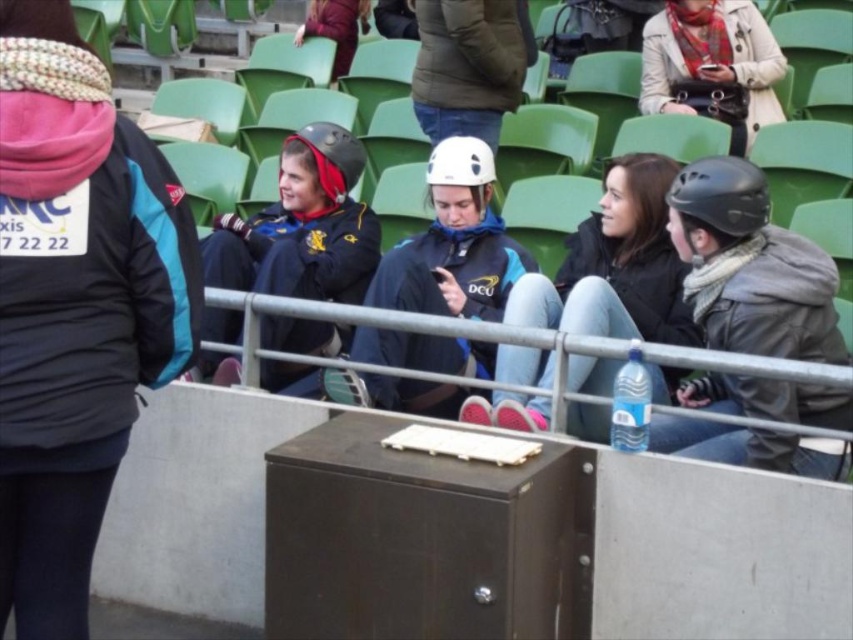
You are a spectator at a sports event and want to locate two items in the scene. The first item is the matte black helmet at left, and the second is the plaid scarf at upper right. Which item is positioned higher in the image?

The plaid scarf at upper right is positioned higher in the image than the matte black helmet at left.

You are a photographer standing at the center of the stadium. You want to take a photo of the matte black helmet at left. Which direction should you move to get a better shot?

The matte black helmet at left is located at point (300,227), so you should move to the left to get a better shot.